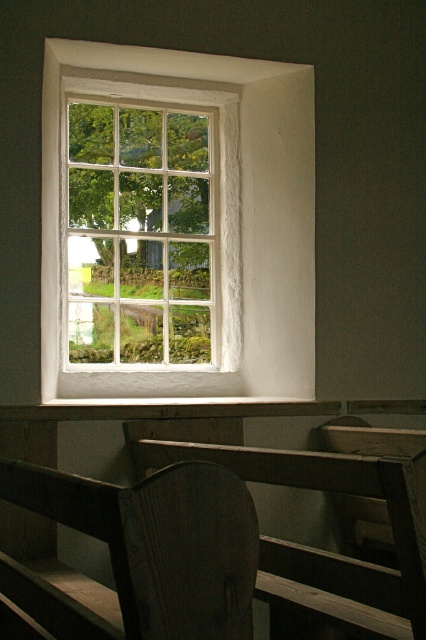
Question: Which point appears farthest from the camera in this image?

Choices:
 (A) (172, 570)
 (B) (101, 122)
 (C) (304, 86)

Answer: (B)

Question: Is wooden bench at lower left to the left of white wooden window at center from the viewer's perspective?

Choices:
 (A) no
 (B) yes

Answer: (A)

Question: Which object is closer to the camera taking this photo?

Choices:
 (A) white textured wood at center
 (B) wooden bench at lower left

Answer: (B)

Question: Does white textured wood at center have a lesser width compared to white wooden window at center?

Choices:
 (A) no
 (B) yes

Answer: (A)

Question: Which is nearer to the white wooden window at center?

Choices:
 (A) white textured wood at center
 (B) wooden bench at lower left

Answer: (A)

Question: From the image, what is the correct spatial relationship of wooden bench at lower left in relation to white wooden window at center?

Choices:
 (A) below
 (B) above

Answer: (A)